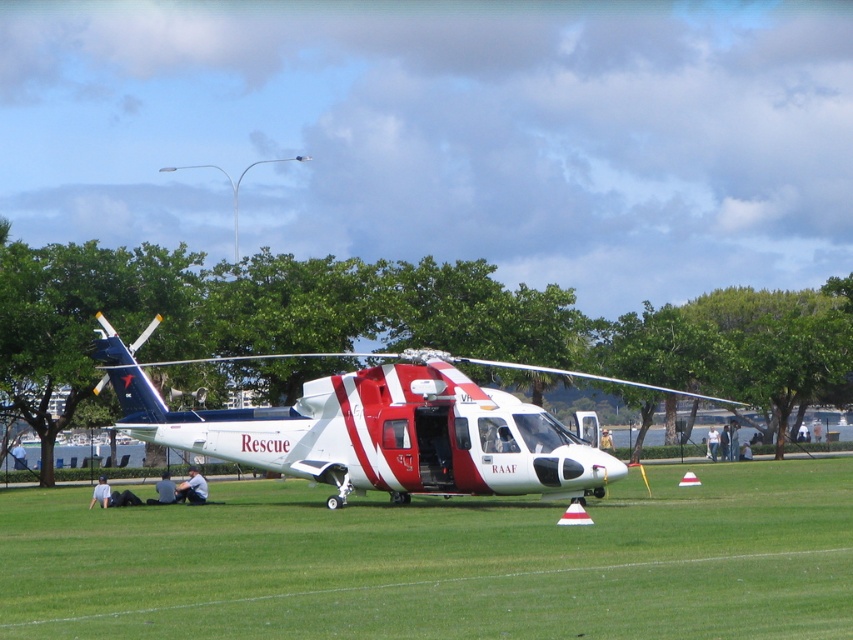
Is green grass at center closer to camera compared to red and white rescue helicopter at center?

That is True.

Is green grass at center smaller than red and white rescue helicopter at center?

Incorrect, green grass at center is not smaller in size than red and white rescue helicopter at center.

Identify the location of green grass at center. The width and height of the screenshot is (853, 640). (440, 563).